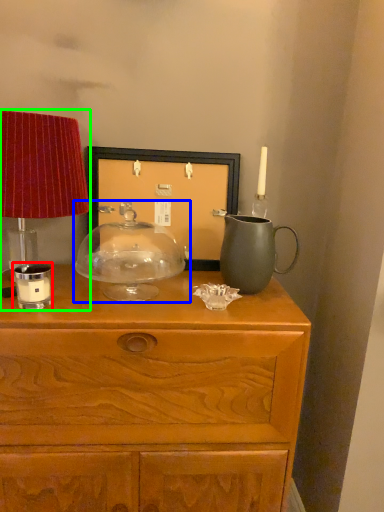
Question: Which object is the closest to the candle holder (highlighted by a red box)? Choose among these: candle holder (highlighted by a blue box) or table lamp (highlighted by a green box).

Choices:
 (A) candle holder
 (B) table lamp

Answer: (B)